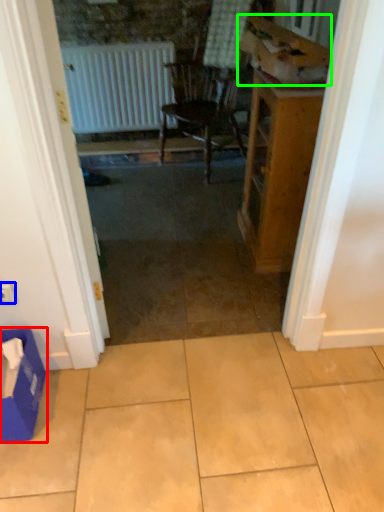
Question: Which object is positioned farthest from cardboard box (highlighted by a red box)? Select from electric outlet (highlighted by a blue box) and cardboard box (highlighted by a green box).

Choices:
 (A) electric outlet
 (B) cardboard box

Answer: (B)